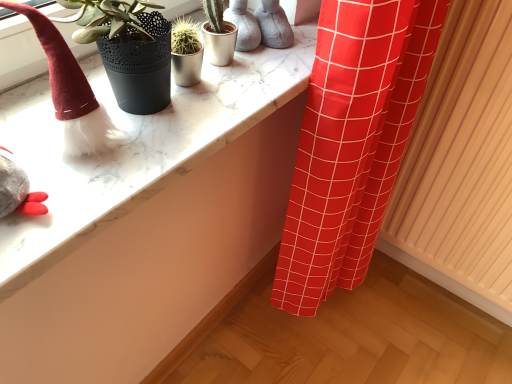
Describe the element at coordinates (71, 92) in the screenshot. Image resolution: width=512 pixels, height=384 pixels. I see `fuzzy red hat at left` at that location.

What are the coordinates of `fuzzy red hat at left` in the screenshot? It's located at (71, 92).

Identify the location of wooden radiator at right. Image resolution: width=512 pixels, height=384 pixels. (461, 164).

From the picture: Is fuzzy red hat at left smaller than marble counter top at upper left?

Yes, fuzzy red hat at left is smaller than marble counter top at upper left.

Based on the photo, which object is wider, fuzzy red hat at left or marble counter top at upper left?

With larger width is marble counter top at upper left.

What's the angular difference between fuzzy red hat at left and marble counter top at upper left's facing directions?

The angle between the facing direction of fuzzy red hat at left and the facing direction of marble counter top at upper left is 1.45 degrees.

Which is more to the left, fuzzy red hat at left or marble counter top at upper left?

Positioned to the left is fuzzy red hat at left.

Is point (476, 113) less distant than point (17, 10)?

No.

Could you tell me if wooden radiator at right is facing fuzzy red hat at left?

No, wooden radiator at right does not turn towards fuzzy red hat at left.

Is fuzzy red hat at left inside wooden radiator at right?

No, wooden radiator at right does not contain fuzzy red hat at left.

How far apart are wooden radiator at right and fuzzy red hat at left?

wooden radiator at right is 36.99 inches from fuzzy red hat at left.

Can you confirm if wooden radiator at right is wider than marble counter top at upper left?

No.

Considering the sizes of wooden radiator at right and marble counter top at upper left in the image, is wooden radiator at right taller or shorter than marble counter top at upper left?

Considering their sizes, wooden radiator at right has more height than marble counter top at upper left.

Does wooden radiator at right appear on the left side of marble counter top at upper left?

In fact, wooden radiator at right is to the right of marble counter top at upper left.

From a real-world perspective, is wooden radiator at right located beneath marble counter top at upper left?

Yes, from a real-world perspective, wooden radiator at right is below marble counter top at upper left.

Based on the photo, is fuzzy red hat at left aimed at wooden radiator at right?

No, fuzzy red hat at left is not turned towards wooden radiator at right.

From the image's perspective, which one is positioned higher, fuzzy red hat at left or wooden radiator at right?

fuzzy red hat at left appears higher in the image.

Consider the image. How much distance is there between fuzzy red hat at left and wooden radiator at right?

fuzzy red hat at left and wooden radiator at right are 36.99 inches apart from each other.

Which is more to the right, fuzzy red hat at left or wooden radiator at right?

wooden radiator at right is more to the right.

Which of these two, marble counter top at upper left or wooden radiator at right, is smaller?

With smaller size is marble counter top at upper left.

Is marble counter top at upper left wider than wooden radiator at right?

Yes.

Is marble counter top at upper left inside or outside of wooden radiator at right?

marble counter top at upper left is not enclosed by wooden radiator at right.

Is marble counter top at upper left further to camera compared to wooden radiator at right?

No, marble counter top at upper left is closer to the camera.

Considering the relative sizes of marble counter top at upper left and fuzzy red hat at left in the image provided, is marble counter top at upper left taller than fuzzy red hat at left?

In fact, marble counter top at upper left may be shorter than fuzzy red hat at left.

Is fuzzy red hat at left at the back of marble counter top at upper left?

marble counter top at upper left is not turned away from fuzzy red hat at left.

Is marble counter top at upper left in contact with fuzzy red hat at left?

No, marble counter top at upper left is not next to fuzzy red hat at left.

Considering the positions of objects marble counter top at upper left and fuzzy red hat at left in the image provided, who is in front, marble counter top at upper left or fuzzy red hat at left?

fuzzy red hat at left.

Image resolution: width=512 pixels, height=384 pixels. Identify the location of counter top that is behind the fuzzy red hat at left. (132, 149).

At what (x,y) coordinates should I click in order to perform the action: click on toy above the wooden radiator at right (from the image's perspective). Please return your answer as a coordinate pair (x, y). This screenshot has height=384, width=512. Looking at the image, I should click on (71, 92).

From the image, which object appears to be nearer to fuzzy red hat at left, wooden radiator at right or marble counter top at upper left?

Based on the image, marble counter top at upper left appears to be nearer to fuzzy red hat at left.

Based on their spatial positions, is marble counter top at upper left or wooden radiator at right closer to fuzzy red hat at left?

Based on the image, marble counter top at upper left appears to be nearer to fuzzy red hat at left.

Looking at the image, which one is located further to marble counter top at upper left, fuzzy red hat at left or wooden radiator at right?

wooden radiator at right lies further to marble counter top at upper left than the other object.

From the image, which object appears to be nearer to marble counter top at upper left, wooden radiator at right or fuzzy red hat at left?

The object closer to marble counter top at upper left is fuzzy red hat at left.

When comparing their distances from wooden radiator at right, does marble counter top at upper left or fuzzy red hat at left seem further?

fuzzy red hat at left is further to wooden radiator at right.

Looking at the image, which one is located closer to wooden radiator at right, fuzzy red hat at left or marble counter top at upper left?

marble counter top at upper left lies closer to wooden radiator at right than the other object.

In order to click on counter top between fuzzy red hat at left and wooden radiator at right in the horizontal direction in this screenshot , I will do `click(132, 149)`.